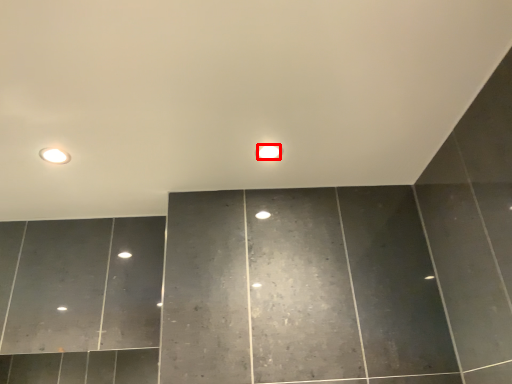
Question: From the image's perspective, where is light bulb (annotated by the red box) located in relation to fixture in the image?

Choices:
 (A) above
 (B) below

Answer: (A)